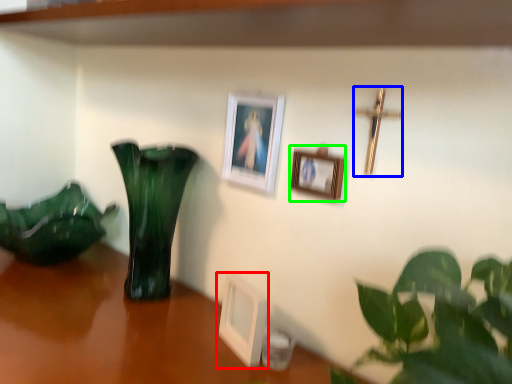
Question: Estimate the real-world distances between objects in this image. Which object is farther from picture frame (highlighted by a red box), crucifix (highlighted by a blue box) or picture frame (highlighted by a green box)?

Choices:
 (A) crucifix
 (B) picture frame

Answer: (A)